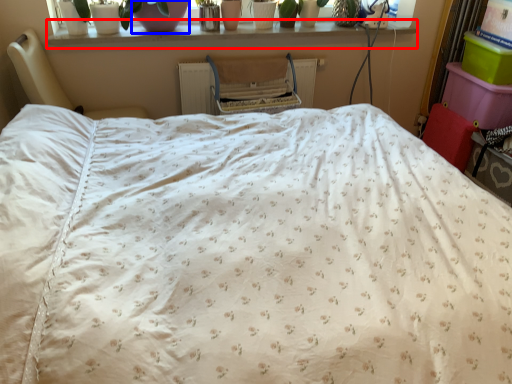
Question: Which object is further to the camera taking this photo, window sill (highlighted by a red box) or glass vase (highlighted by a blue box)?

Choices:
 (A) window sill
 (B) glass vase

Answer: (A)